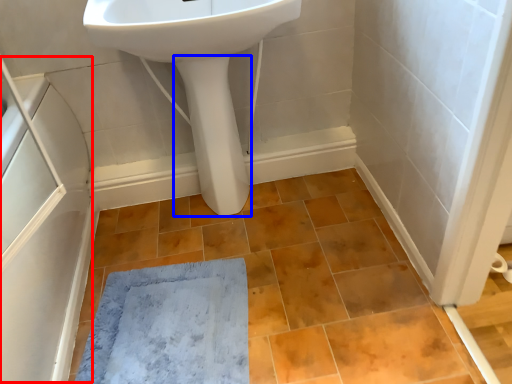
Question: Among these objects, which one is nearest to the camera, screen door (highlighted by a red box) or bidet (highlighted by a blue box)?

Choices:
 (A) screen door
 (B) bidet

Answer: (A)